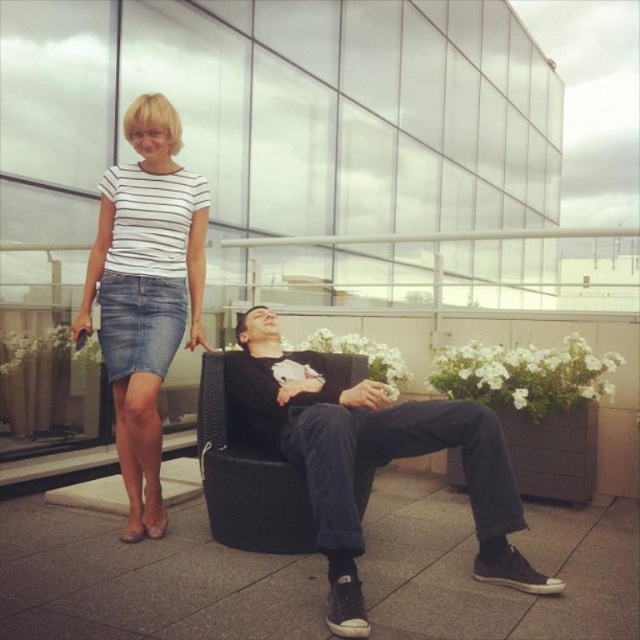
You are a photographer setting up a shoot on the rooftop terrace. You need to position a tripod between the black matte chair at center and the denim skirt at left. Which side of the path between them should you place the tripod to ensure it doesn t hit either object?

The black matte chair at center is wider than the denim skirt at left. To avoid hitting either object, place the tripod closer to the side of the denim skirt at left since it has less width.

You are planning to place a new small potted plant between the black matte chair at center and the denim skirt at left. Considering their sizes, will the plant fit comfortably without overcrowding the space?

The black matte chair at center is larger in size than the denim skirt at left. Since the plant is small, it should fit comfortably between them without overcrowding the space as the larger chair and smaller skirt provide enough spacing.

You are standing on the rooftop terrace and want to walk from the denim skirt at left to the black woven swivel chair at center. Which direction should you move to get closer to the chair?

You should move to the right to get closer to the black woven swivel chair at center because the denim skirt at left is further to the viewer than the chair, indicating the chair is positioned more towards the center of the terrace.